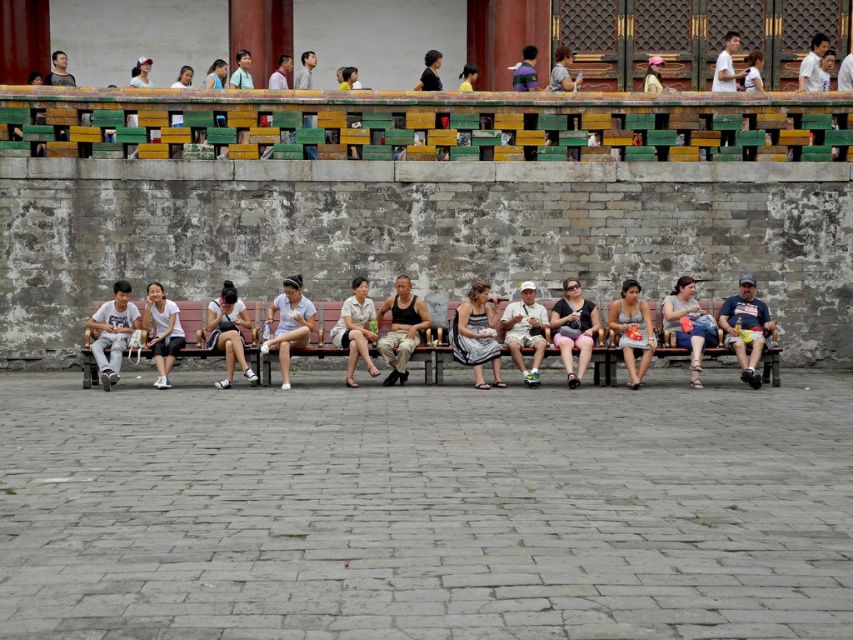
You are a photographer trying to capture a candid shot of the striped fabric dress at center and the white matte shorts at center. Since you want to ensure both are visible in the frame, can you determine which one is to the left of the other?

The striped fabric dress at center is positioned on the right side of white matte shorts at center, so the white matte shorts at center is to the left of the striped fabric dress at center.

From the picture: You are a photographer trying to capture a candid shot of the denim shorts at center without including the brown wooden bench at center in the frame. Given their heights, is this possible?

The brown wooden bench at center has a lesser height compared to denim shorts at center, so it is possible to capture the denim shorts at center without including the bench in the frame by adjusting the camera angle to focus on the higher position of the shorts.